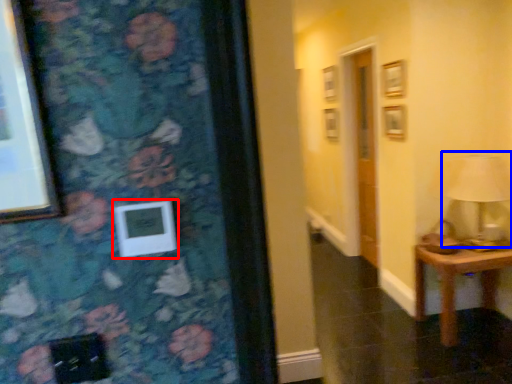
Question: Which of the following is the farthest to the observer, picture frame (highlighted by a red box) or table lamp (highlighted by a blue box)?

Choices:
 (A) picture frame
 (B) table lamp

Answer: (B)